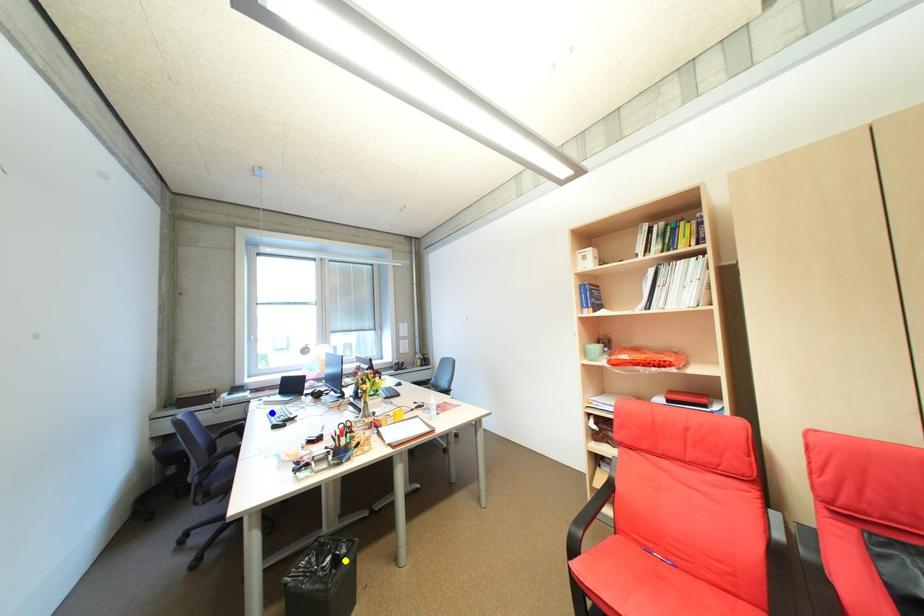
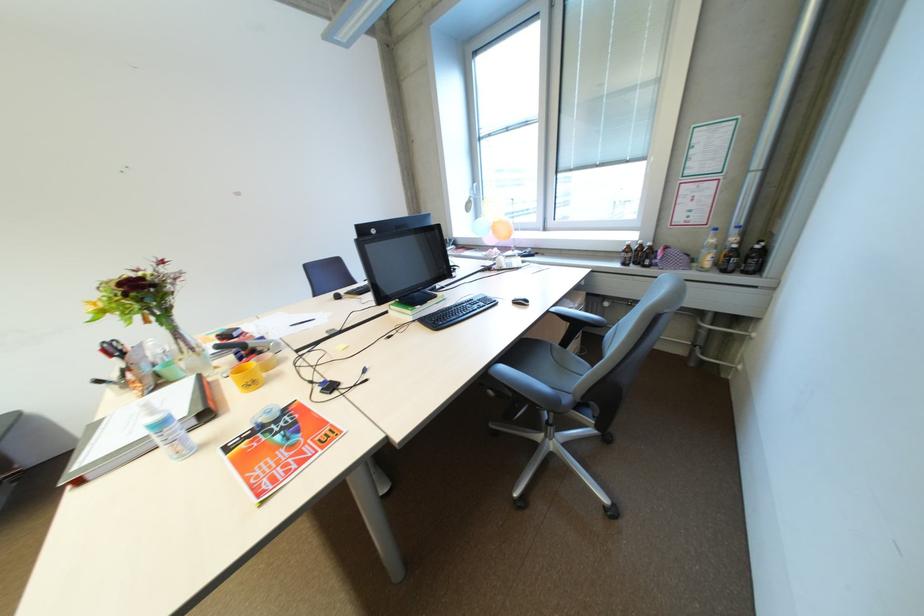
I am providing you with two images of the same scene from different viewpoints. Three points are marked in image1. Which point corresponds to a part or object that is occluded in image2?In image1, three points are marked. Which of them correspond to a part or object that is occluded in image2?Among the three points shown in image1, which one corresponds to a part or object that is no longer visible due to occlusion in image2?

Invisible in image2: green point, blue point, yellow point.